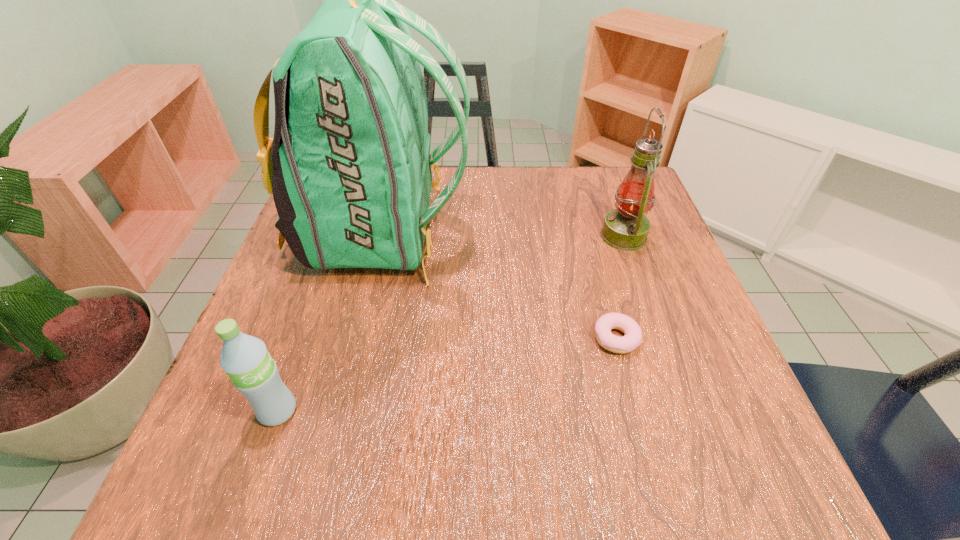
You are a GUI agent. You are given a task and a screenshot of the screen. Output one action in this format:
    pyautogui.click(x=<x>, y=<y>)
    Task: Click on the backpack that is at the far edge
    The width and height of the screenshot is (960, 540).
    Given the screenshot: What is the action you would take?
    pyautogui.click(x=349, y=166)

Identify the location of oil lamp present at the far edge. (626, 228).

Identify the location of backpack that is at the left edge. The image size is (960, 540). (349, 166).

At what (x,y) coordinates should I click in order to perform the action: click on water bottle at the left edge. Please return your answer as a coordinate pair (x, y). The width and height of the screenshot is (960, 540). Looking at the image, I should click on (245, 359).

Locate an element on the screen. oil lamp positioned at the right edge is located at coordinates (626, 228).

Where is `doughnut positioned at the right edge`? The image size is (960, 540). doughnut positioned at the right edge is located at coordinates (632, 339).

This screenshot has height=540, width=960. I want to click on object present at the far left corner, so click(x=349, y=166).

You are a GUI agent. You are given a task and a screenshot of the screen. Output one action in this format:
    pyautogui.click(x=<x>, y=<y>)
    Task: Click on the object located in the far right corner section of the desktop
    This screenshot has height=540, width=960.
    Given the screenshot: What is the action you would take?
    pyautogui.click(x=626, y=228)

Where is `vacant area at the far edge of the desktop`? vacant area at the far edge of the desktop is located at coordinates (533, 200).

Where is `vacant space at the left edge of the desktop`? This screenshot has height=540, width=960. vacant space at the left edge of the desktop is located at coordinates (299, 269).